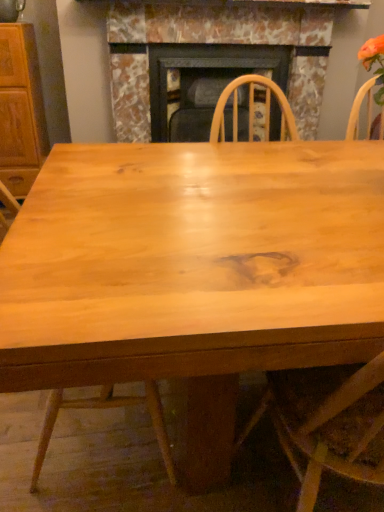
Question: From the image's perspective, is wooden cabinet at left below marble fireplace at center?

Choices:
 (A) yes
 (B) no

Answer: (A)

Question: Does wooden cabinet at left turn towards marble fireplace at center?

Choices:
 (A) yes
 (B) no

Answer: (B)

Question: Is wooden cabinet at left next to marble fireplace at center and touching it?

Choices:
 (A) yes
 (B) no

Answer: (B)

Question: Does wooden cabinet at left appear on the right side of marble fireplace at center?

Choices:
 (A) no
 (B) yes

Answer: (A)

Question: Is marble fireplace at center at the back of wooden cabinet at left?

Choices:
 (A) no
 (B) yes

Answer: (A)

Question: Considering the positions of point (289, 10) and point (0, 129), is point (289, 10) closer or farther from the camera than point (0, 129)?

Choices:
 (A) closer
 (B) farther

Answer: (A)

Question: From a real-world perspective, is marble fireplace at center above or below wooden cabinet at left?

Choices:
 (A) below
 (B) above

Answer: (B)

Question: Relative to wooden cabinet at left, is marble fireplace at center in front or behind?

Choices:
 (A) front
 (B) behind

Answer: (B)

Question: In terms of height, does marble fireplace at center look taller or shorter compared to wooden cabinet at left?

Choices:
 (A) short
 (B) tall

Answer: (A)

Question: Does point (157, 3) appear closer or farther from the camera than point (140, 402)?

Choices:
 (A) farther
 (B) closer

Answer: (A)

Question: Considering the positions of marble fireplace at center and natural wood chair at center in the image, is marble fireplace at center taller or shorter than natural wood chair at center?

Choices:
 (A) short
 (B) tall

Answer: (A)

Question: Is marble fireplace at center bigger or smaller than natural wood chair at center?

Choices:
 (A) small
 (B) big

Answer: (B)

Question: Which is correct: marble fireplace at center is inside natural wood chair at center, or outside of it?

Choices:
 (A) inside
 (B) outside

Answer: (B)

Question: From the image's perspective, is wooden cabinet at left positioned above or below natural wood chair at center?

Choices:
 (A) below
 (B) above

Answer: (B)

Question: Looking at the image, does wooden cabinet at left seem bigger or smaller compared to natural wood chair at center?

Choices:
 (A) small
 (B) big

Answer: (A)